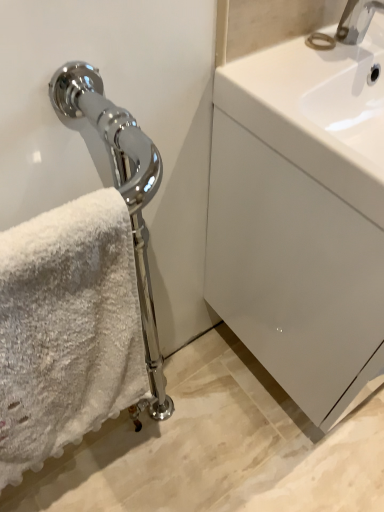
Question: Do you think chrome metallic faucet at upper right is within white glossy drawer at right, or outside of it?

Choices:
 (A) inside
 (B) outside

Answer: (B)

Question: Considering the positions of point pos(362,5) and point pos(367,364), is point pos(362,5) closer or farther from the camera than point pos(367,364)?

Choices:
 (A) farther
 (B) closer

Answer: (A)

Question: Which object is the closest to the white glossy sink at upper right?

Choices:
 (A) white glossy drawer at right
 (B) chrome metallic faucet at upper right
 (C) white fluffy towel at left

Answer: (B)

Question: Which object is the farthest from the white fluffy towel at left?

Choices:
 (A) chrome metallic faucet at upper right
 (B) white glossy sink at upper right
 (C) white glossy drawer at right

Answer: (A)